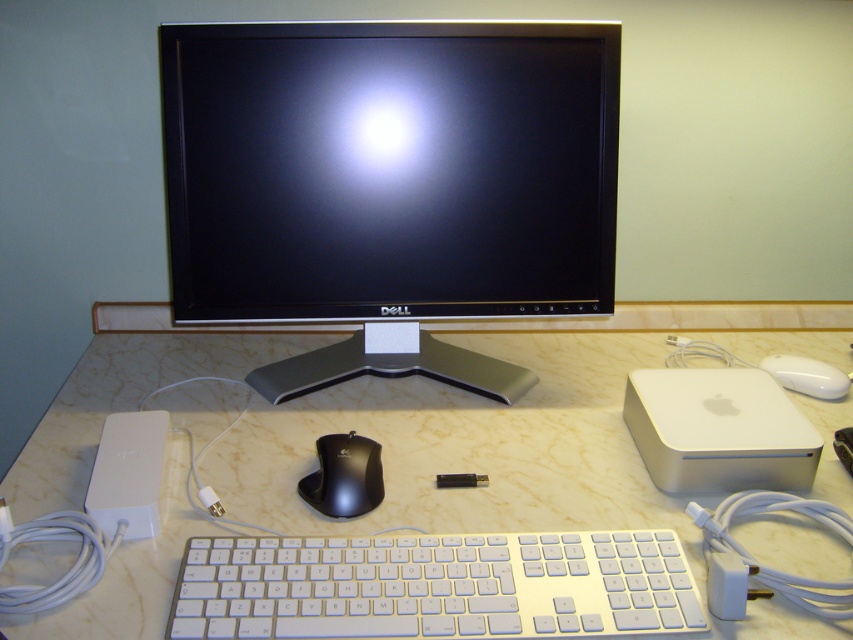
Question: Can you confirm if satin black monitor at center is positioned below white plastic keyboard at center?

Choices:
 (A) no
 (B) yes

Answer: (A)

Question: Which object is closer to the camera taking this photo?

Choices:
 (A) white marble computer desk at center
 (B) black glossy mouse at center
 (C) white plastic keyboard at center

Answer: (C)

Question: Is satin black monitor at center further to the viewer compared to white marble computer desk at center?

Choices:
 (A) no
 (B) yes

Answer: (B)

Question: Which is nearer to the white plastic keyboard at center?

Choices:
 (A) black glossy mouse at center
 (B) satin black monitor at center
 (C) white marble computer desk at center

Answer: (A)

Question: Where is white marble computer desk at center located in relation to white plastic keyboard at center in the image?

Choices:
 (A) below
 (B) above

Answer: (B)

Question: Which point is closer to the camera taking this photo?

Choices:
 (A) (589, 609)
 (B) (231, 397)
 (C) (334, 202)
 (D) (376, 486)

Answer: (A)